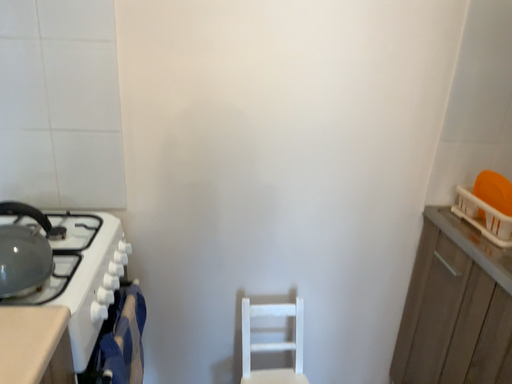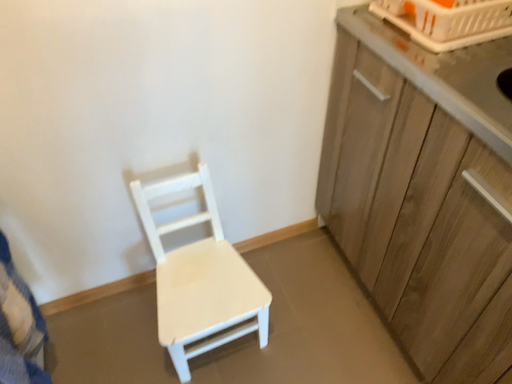
Question: How did the camera likely rotate when shooting the video?

Choices:
 (A) rotated downward
 (B) rotated upward

Answer: (A)